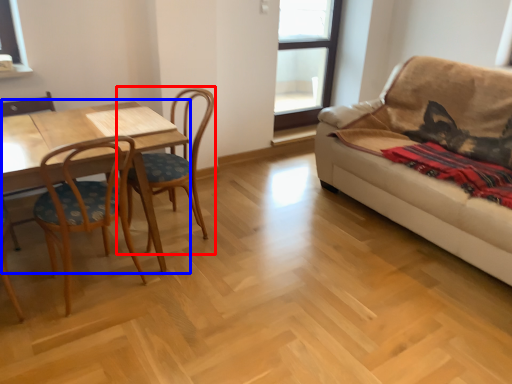
Question: Which point is closer to the camera, chair (highlighted by a red box) or table (highlighted by a blue box)?

Choices:
 (A) chair
 (B) table

Answer: (B)